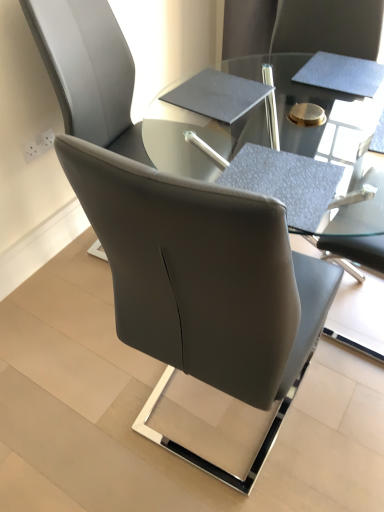
Question: Considering the relative sizes of satin black chair at center and black matte notebook at center in the image provided, is satin black chair at center thinner than black matte notebook at center?

Choices:
 (A) no
 (B) yes

Answer: (A)

Question: Can we say satin black chair at center lies outside black matte notebook at center?

Choices:
 (A) yes
 (B) no

Answer: (A)

Question: Is satin black chair at center in front of black matte notebook at center?

Choices:
 (A) no
 (B) yes

Answer: (B)

Question: Is satin black chair at center at the right side of black matte notebook at center?

Choices:
 (A) no
 (B) yes

Answer: (A)

Question: Could you tell me if satin black chair at center is facing black matte notebook at center?

Choices:
 (A) no
 (B) yes

Answer: (A)

Question: Is satin black chair at center surrounding black matte notebook at center?

Choices:
 (A) yes
 (B) no

Answer: (B)

Question: Can you confirm if black matte notebook at center is thinner than matte gray table at center?

Choices:
 (A) no
 (B) yes

Answer: (B)

Question: Would you say matte gray table at center is part of black matte notebook at center's contents?

Choices:
 (A) yes
 (B) no

Answer: (B)

Question: From a real-world perspective, is black matte notebook at center located higher than matte gray table at center?

Choices:
 (A) yes
 (B) no

Answer: (A)

Question: Is black matte notebook at center closer to the viewer compared to matte gray table at center?

Choices:
 (A) yes
 (B) no

Answer: (B)

Question: Is black matte notebook at center at the right side of matte gray table at center?

Choices:
 (A) yes
 (B) no

Answer: (B)

Question: Is black matte notebook at center facing towards matte gray table at center?

Choices:
 (A) yes
 (B) no

Answer: (B)

Question: Would you say matte gray table at center is outside black matte notebook at center?

Choices:
 (A) yes
 (B) no

Answer: (A)